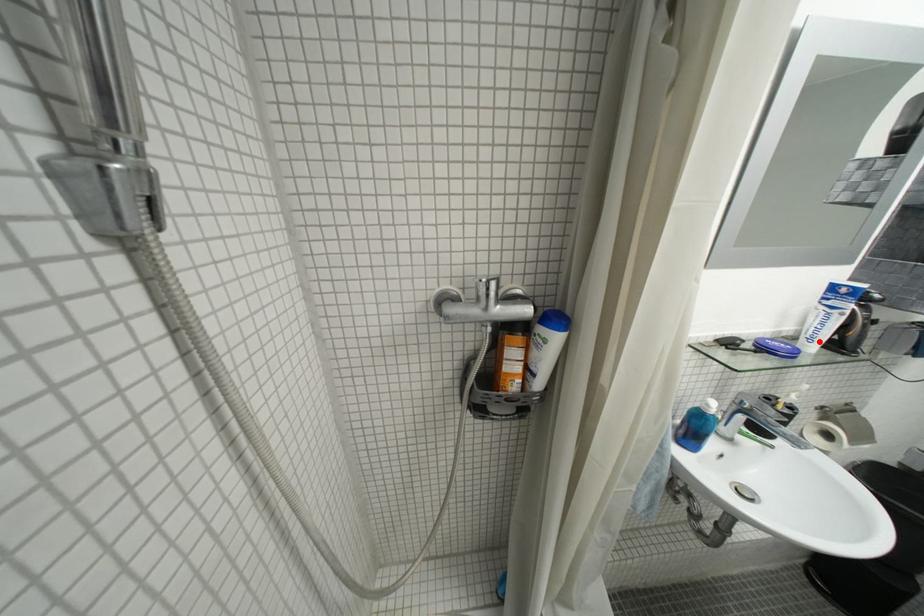
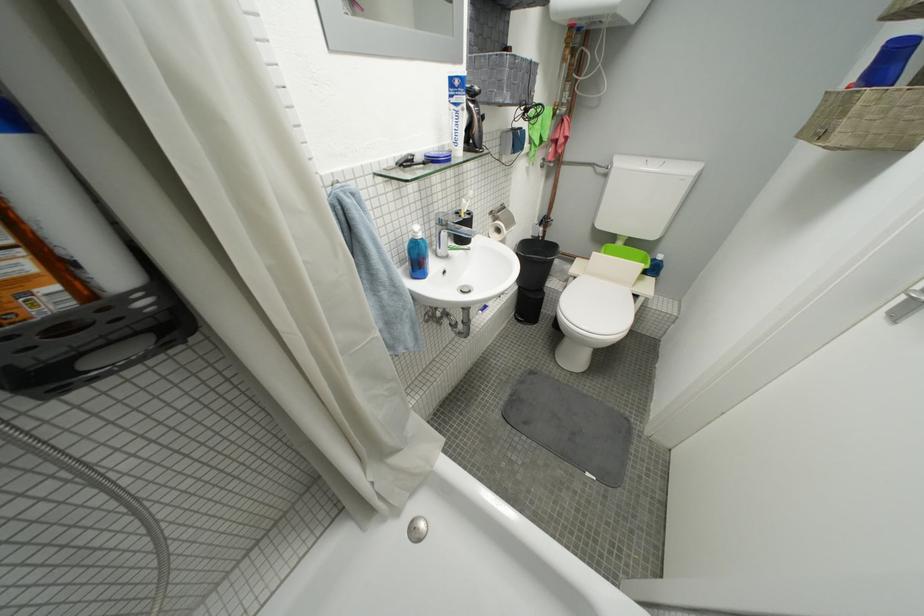
In the second image, find the point that corresponds to the highlighted location in the first image.

(465, 145)